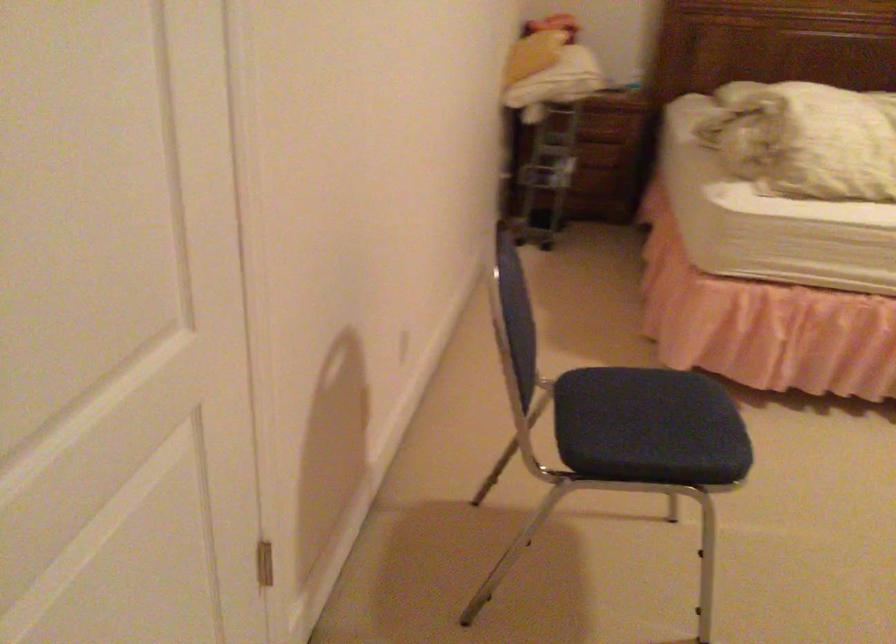
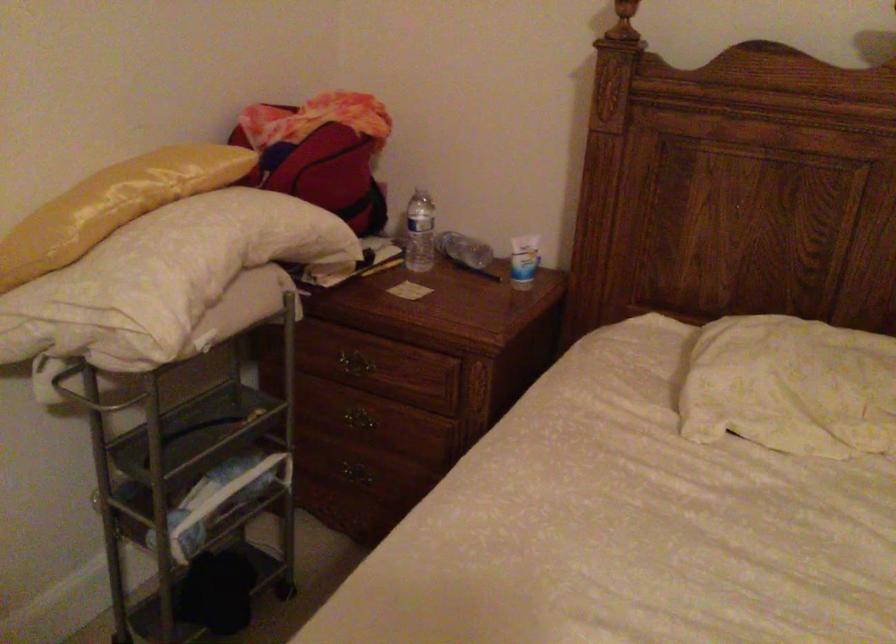
Locate, in the second image, the point that corresponds to pixel 567 111 in the first image.

(350, 365)